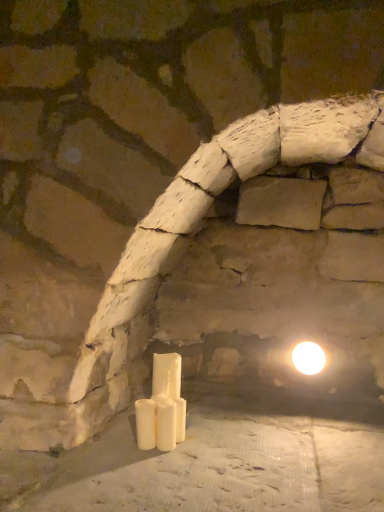
Question: From the image's perspective, does white matte candle at center, which is the 3th candle from back to front, appear higher than white matte candle at lower center, the 2th candle when ordered from back to front?

Choices:
 (A) no
 (B) yes

Answer: (A)

Question: From the image's perspective, is white matte candle at center, the first candle viewed from the front, located beneath white matte candle at lower center, the 2th candle when ordered from back to front?

Choices:
 (A) no
 (B) yes

Answer: (B)

Question: Is white matte candle at center, which is the 3th candle from back to front, wider than white matte candle at lower center, which is the 2th candle in front-to-back order?

Choices:
 (A) yes
 (B) no

Answer: (A)

Question: From a real-world perspective, is white matte candle at center, the first candle viewed from the front, on white matte candle at lower center, which is the 2th candle in front-to-back order?

Choices:
 (A) no
 (B) yes

Answer: (B)

Question: Is white matte candle at lower center, which is the 2th candle in front-to-back order, a part of white matte candle at center, the first candle viewed from the front?

Choices:
 (A) no
 (B) yes

Answer: (A)

Question: From the image's perspective, relative to white glossy candle at center, which is the third candle in front-to-back order, is white matte candle at center, which is the 3th candle from back to front, above or below?

Choices:
 (A) below
 (B) above

Answer: (A)

Question: Do you think white matte candle at center, which is the 3th candle from back to front, is within white glossy candle at center, the first candle positioned from the back, or outside of it?

Choices:
 (A) inside
 (B) outside

Answer: (B)

Question: Is point (158, 421) closer or farther from the camera than point (139, 440)?

Choices:
 (A) farther
 (B) closer

Answer: (A)

Question: In the image, is white matte candle at center, which is the 3th candle from back to front, positioned in front of or behind white glossy candle at center, the first candle positioned from the back?

Choices:
 (A) behind
 (B) front

Answer: (B)

Question: Is white matte candle at center, which is the 3th candle from back to front, in front of or behind white glossy light bulb at upper right in the image?

Choices:
 (A) behind
 (B) front

Answer: (B)

Question: Is white matte candle at center, which is the 3th candle from back to front, inside the boundaries of white glossy light bulb at upper right, or outside?

Choices:
 (A) inside
 (B) outside

Answer: (B)

Question: Based on their sizes in the image, would you say white matte candle at center, the first candle viewed from the front, is bigger or smaller than white glossy light bulb at upper right?

Choices:
 (A) big
 (B) small

Answer: (B)

Question: Considering the positions of white matte candle at center, which is the 3th candle from back to front, and white glossy light bulb at upper right in the image, is white matte candle at center, which is the 3th candle from back to front, taller or shorter than white glossy light bulb at upper right?

Choices:
 (A) short
 (B) tall

Answer: (B)

Question: Considering the positions of white glossy light bulb at upper right and white glossy candle at center, the first candle positioned from the back, in the image, is white glossy light bulb at upper right taller or shorter than white glossy candle at center, the first candle positioned from the back,?

Choices:
 (A) tall
 (B) short

Answer: (B)

Question: From a real-world perspective, relative to white glossy candle at center, the first candle positioned from the back, is white glossy light bulb at upper right vertically above or below?

Choices:
 (A) below
 (B) above

Answer: (B)